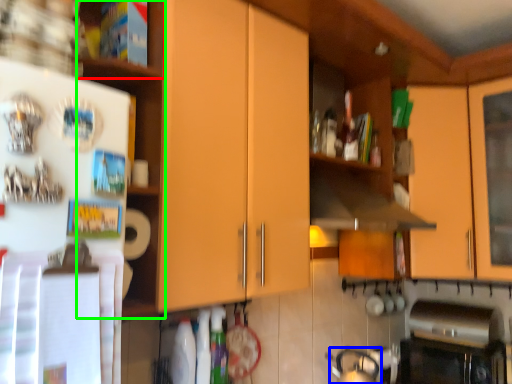
Question: Based on their relative distances, which object is nearer to shelf (highlighted by a red box)? Choose from tea pot (highlighted by a blue box) and shelf (highlighted by a green box).

Choices:
 (A) tea pot
 (B) shelf

Answer: (B)